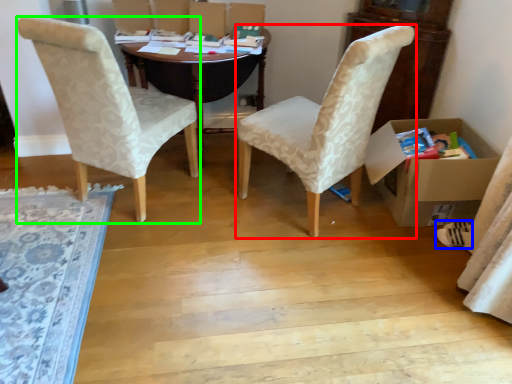
Question: Which object is positioned closest to chair (highlighted by a red box)? Select from footwear (highlighted by a blue box) and chair (highlighted by a green box).

Choices:
 (A) footwear
 (B) chair

Answer: (B)